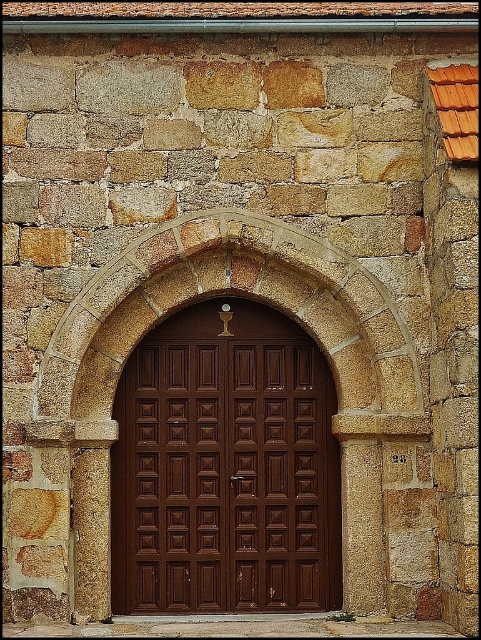
Who is higher up, brown wooden door at center or stone textured archway at center?

stone textured archway at center

Can you confirm if brown wooden door at center is taller than stone textured archway at center?

No.

Identify the location of brown wooden door at center. This screenshot has height=640, width=481. [x=225, y=468].

The height and width of the screenshot is (640, 481). What are the coordinates of `brown wooden door at center` in the screenshot? It's located at (225, 468).